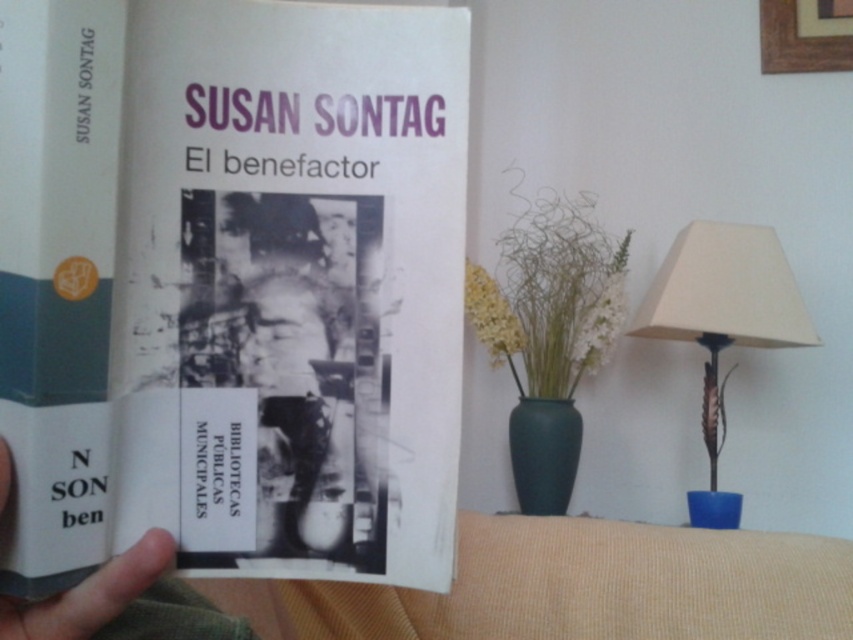
Question: Which of these objects is positioned closest to the gray matte finger at center?

Choices:
 (A) hardcover book at center
 (B) beige fabric lampshade at right

Answer: (A)

Question: Which point appears farthest from the camera in this image?

Choices:
 (A) (160, 545)
 (B) (654, 308)
 (C) (332, 390)

Answer: (B)

Question: Which of the following is the farthest from the observer?

Choices:
 (A) (793, 326)
 (B) (132, 458)
 (C) (135, 596)

Answer: (A)

Question: Is hardcover book at center positioned behind gray matte finger at center?

Choices:
 (A) no
 (B) yes

Answer: (B)

Question: Does hardcover book at center appear under beige fabric lampshade at right?

Choices:
 (A) no
 (B) yes

Answer: (A)

Question: Does hardcover book at center lie in front of beige fabric lampshade at right?

Choices:
 (A) yes
 (B) no

Answer: (A)